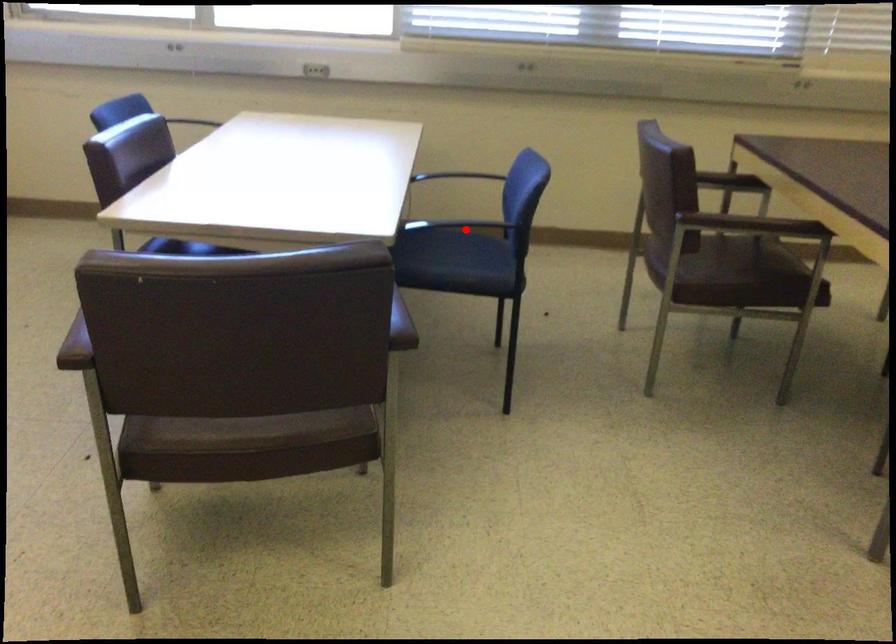
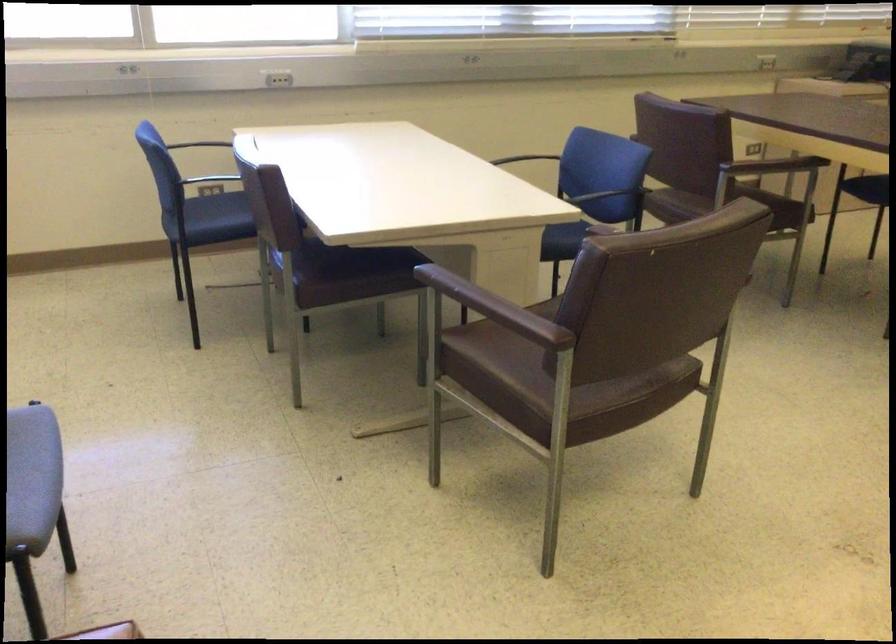
Question: I am providing you with two images of the same scene from different viewpoints. A red point is marked on the first image. At the location where the point appears in image 1, is it still visible in image 2?

Choices:
 (A) Yes
 (B) No

Answer: (B)